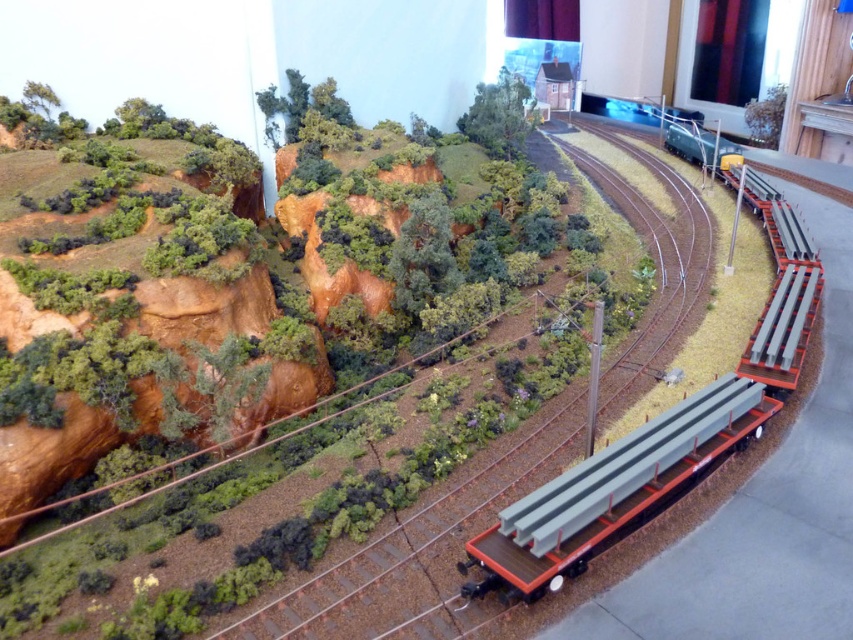
Is metallic gray train track at center wider than metallic gray beams at right?

Correct, the width of metallic gray train track at center exceeds that of metallic gray beams at right.

Who is taller, metallic gray train track at center or metallic gray beams at right?

Standing taller between the two is metallic gray train track at center.

Is point (357, 593) farther from viewer compared to point (556, 488)?

That is False.

Where is `metallic gray train track at center`? The height and width of the screenshot is (640, 853). metallic gray train track at center is located at coordinates (416, 545).